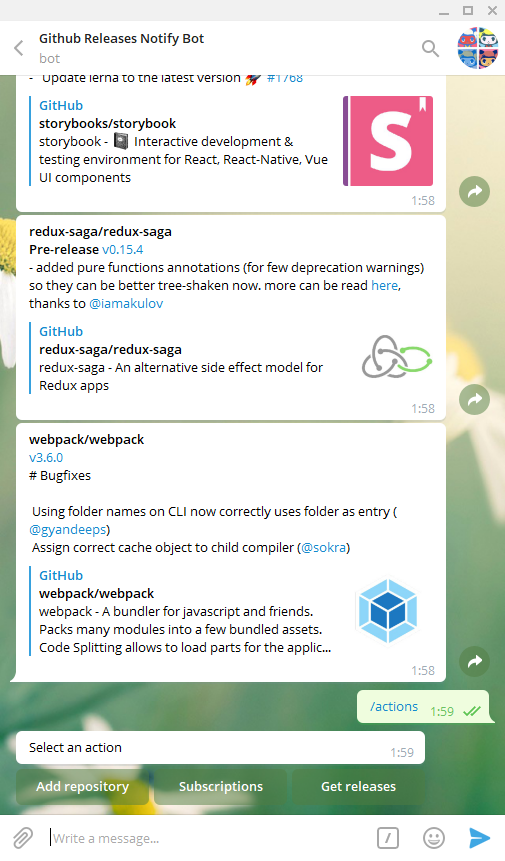
The image size is (505, 861). What are the coordinates of `pink box` in the screenshot? It's located at (357, 108), (175, 741).